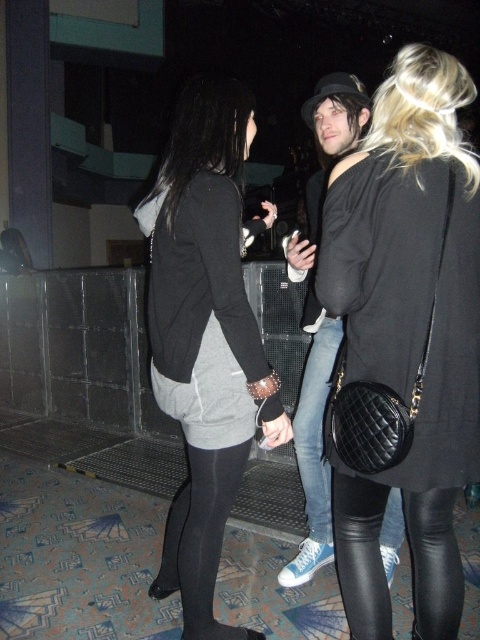
You are at a social event and need to navigate between the denim jeans at center and the dark gray fleece sweatshirt at center. Based on their widths, which one should you avoid stepping closer to?

The denim jeans at center might be wider than dark gray fleece sweatshirt at center, so you should avoid stepping closer to the denim jeans at center to prevent encroaching on personal space.

You are at a social event and need to decide which clothing item to choose between the denim jeans at center and the black leather leggings at lower right. Considering their sizes, which one would you pick if you want something more spacious?

The denim jeans at center is bigger than the black leather leggings at lower right, so you should choose the denim jeans at center for more spaciousness.